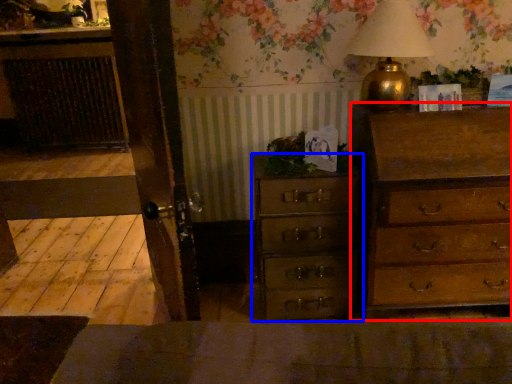
Question: Among these objects, which one is nearest to the camera, chest of drawers (highlighted by a red box) or chest of drawers (highlighted by a blue box)?

Choices:
 (A) chest of drawers
 (B) chest of drawers

Answer: (A)